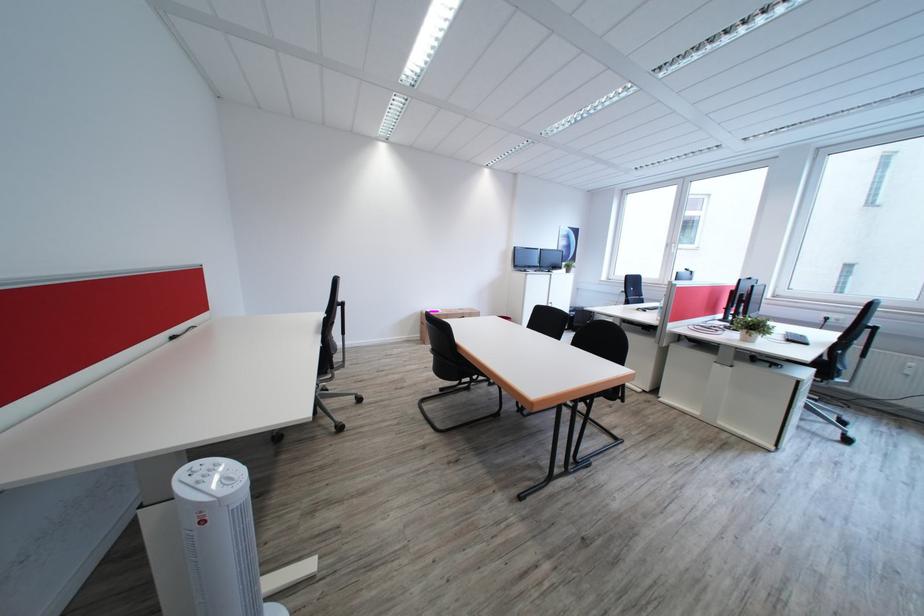
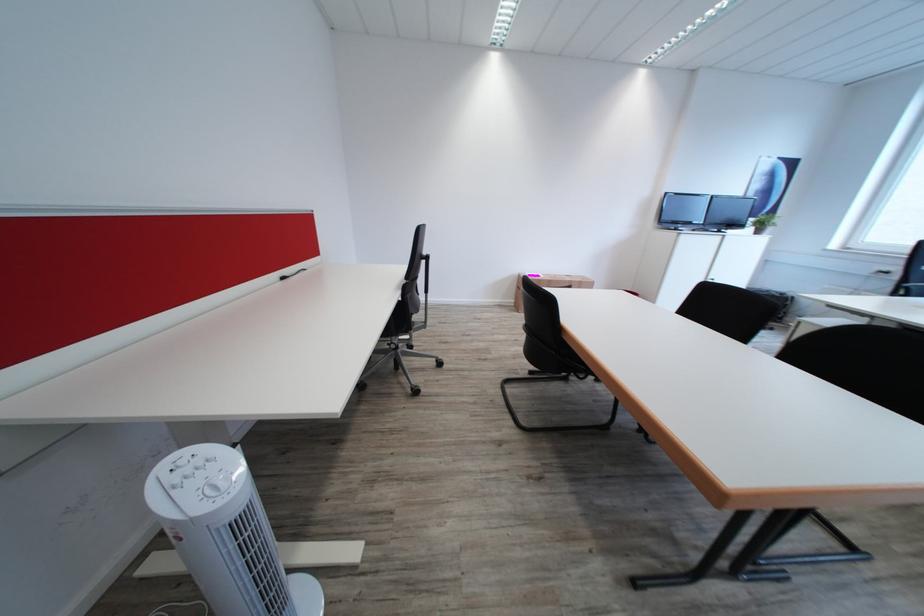
Question: The images are taken continuously from a first-person perspective. In which direction is your viewpoint rotating?

Choices:
 (A) Left
 (B) Right
 (C) Up
 (D) Down

Answer: (A)